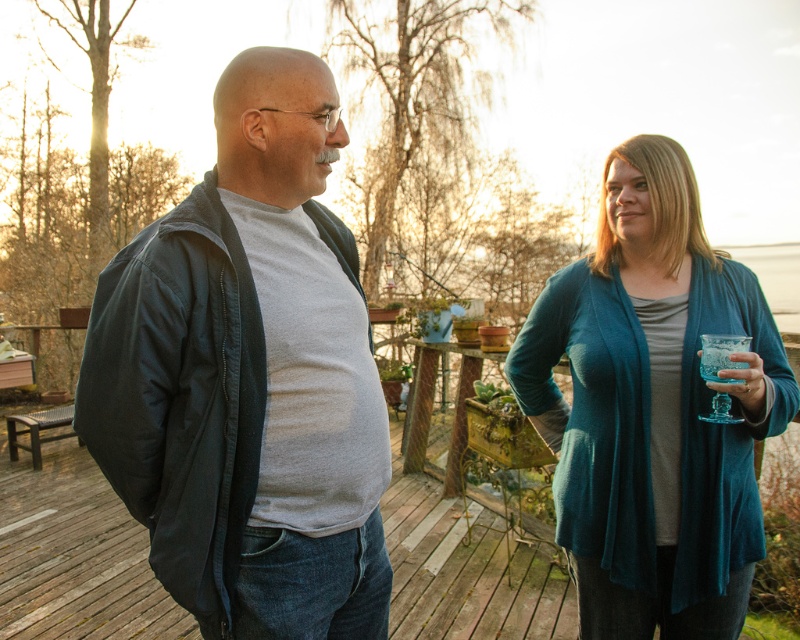
Is matte black jacket at left bigger than teal knit cardigan at right?

No, matte black jacket at left is not bigger than teal knit cardigan at right.

Can you confirm if matte black jacket at left is taller than teal knit cardigan at right?

Yes, matte black jacket at left is taller than teal knit cardigan at right.

Describe the element at coordinates (228, 374) in the screenshot. The height and width of the screenshot is (640, 800). I see `matte black jacket at left` at that location.

The image size is (800, 640). I want to click on matte black jacket at left, so click(x=228, y=374).